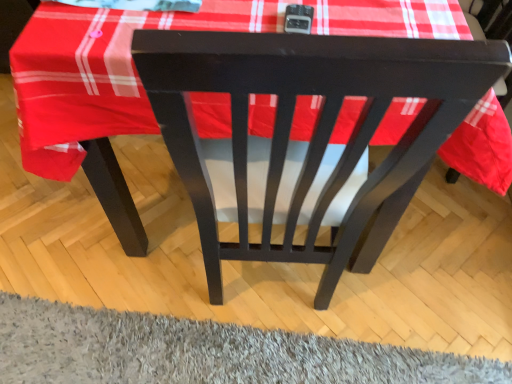
Question: In terms of height, does gray shaggy rug at lower center look taller or shorter compared to matte black chair at center?

Choices:
 (A) short
 (B) tall

Answer: (A)

Question: Is point (7, 337) closer or farther from the camera than point (184, 69)?

Choices:
 (A) closer
 (B) farther

Answer: (B)

Question: Considering the positions of gray shaggy rug at lower center and matte black chair at center in the image, is gray shaggy rug at lower center wider or thinner than matte black chair at center?

Choices:
 (A) thin
 (B) wide

Answer: (A)

Question: Is matte black chair at center taller or shorter than gray shaggy rug at lower center?

Choices:
 (A) short
 (B) tall

Answer: (B)

Question: From the image's perspective, is matte black chair at center positioned above or below gray shaggy rug at lower center?

Choices:
 (A) below
 (B) above

Answer: (B)

Question: Considering the positions of point (417, 117) and point (138, 332), is point (417, 117) closer or farther from the camera than point (138, 332)?

Choices:
 (A) closer
 (B) farther

Answer: (A)

Question: Is matte black chair at center situated inside gray shaggy rug at lower center or outside?

Choices:
 (A) inside
 (B) outside

Answer: (B)